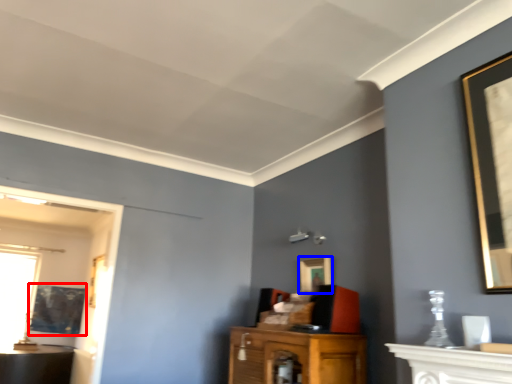
Question: Which of the following is the closest to the observer, picture frame (highlighted by a red box) or picture frame (highlighted by a blue box)?

Choices:
 (A) picture frame
 (B) picture frame

Answer: (B)